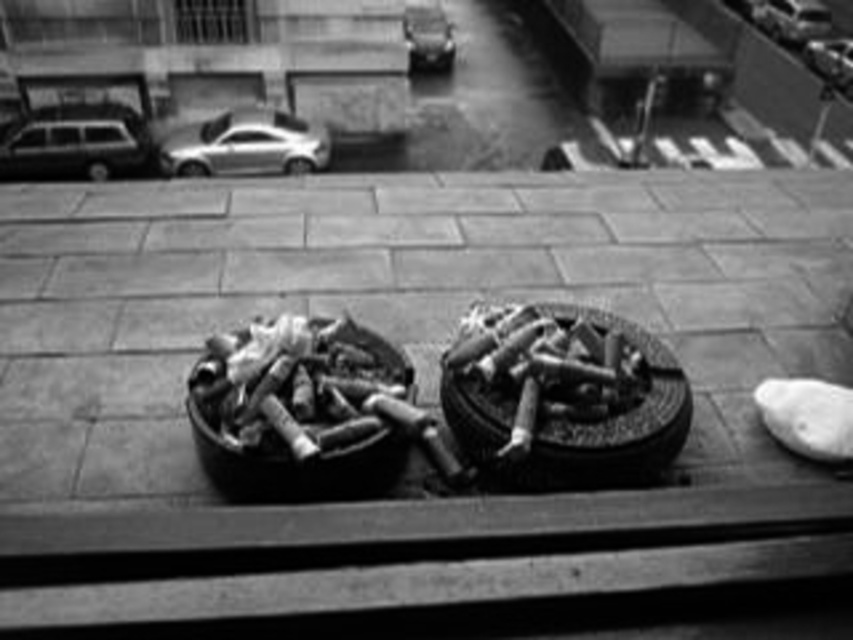
Can you confirm if shiny metallic car at upper center is positioned to the left of shiny silver sedan at upper right?

Correct, you'll find shiny metallic car at upper center to the left of shiny silver sedan at upper right.

Which is below, shiny metallic car at upper center or shiny silver sedan at upper right?

Positioned lower is shiny silver sedan at upper right.

Is point (788, 4) positioned in front of point (821, 74)?

No, (788, 4) is further to viewer.

Locate an element on the screen. shiny metallic car at upper center is located at coordinates (791, 19).

Between point (218, 141) and point (444, 51), which one is positioned in front?

Positioned in front is point (218, 141).

Can you confirm if shiny silver sedan at upper center is taller than metallic silver car at upper center?

No, shiny silver sedan at upper center is not taller than metallic silver car at upper center.

Is point (195, 131) positioned behind point (405, 19)?

No, it is not.

Locate an element on the screen. shiny silver sedan at upper center is located at coordinates (245, 145).

Can you confirm if metallic silver van at left is positioned to the right of shiny silver sedan at upper right?

No, metallic silver van at left is not to the right of shiny silver sedan at upper right.

Between metallic silver van at left and shiny silver sedan at upper right, which one has less height?

metallic silver van at left

Is point (59, 129) closer to viewer compared to point (831, 45)?

Yes, it is in front of point (831, 45).

Identify the location of metallic silver van at left. (71, 148).